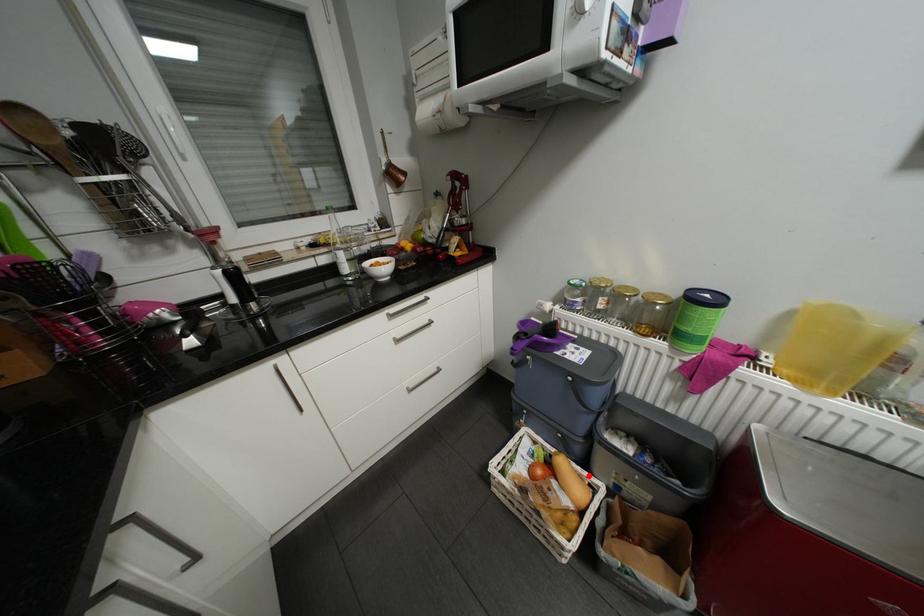
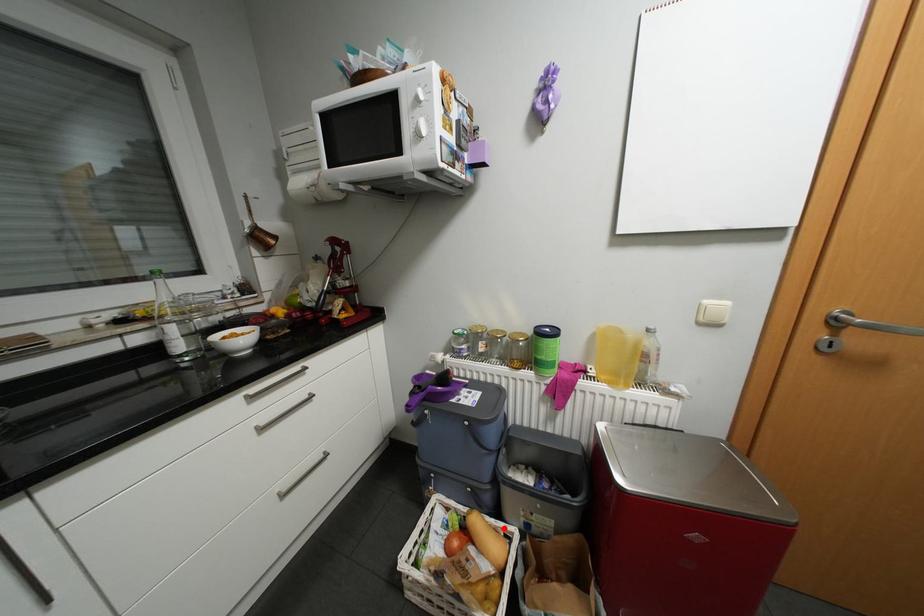
I am providing you with two images of the same scene from different viewpoints. A red point is marked on the first image and another point is marked on the second image. Is the marked point in image1 the same physical position as the marked point in image2?

Yes